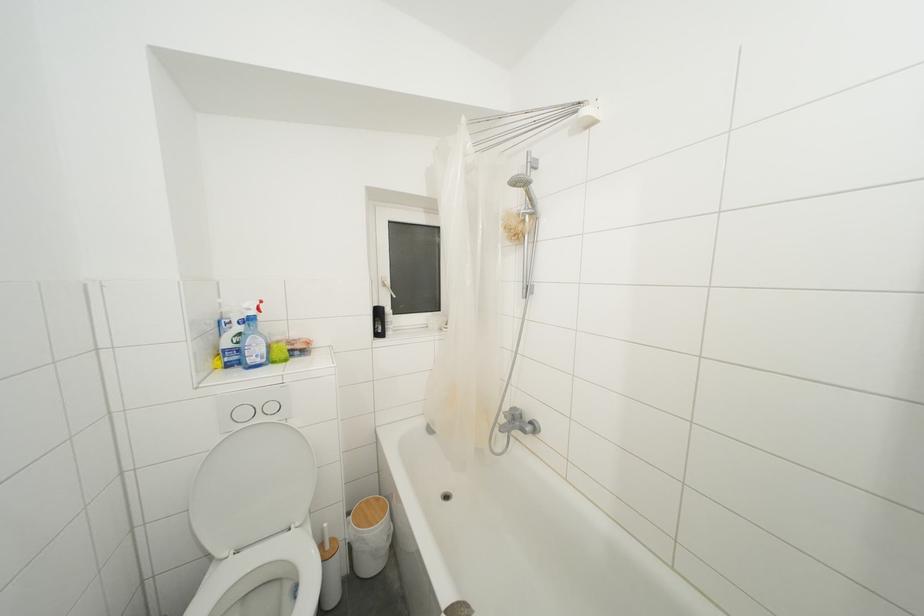
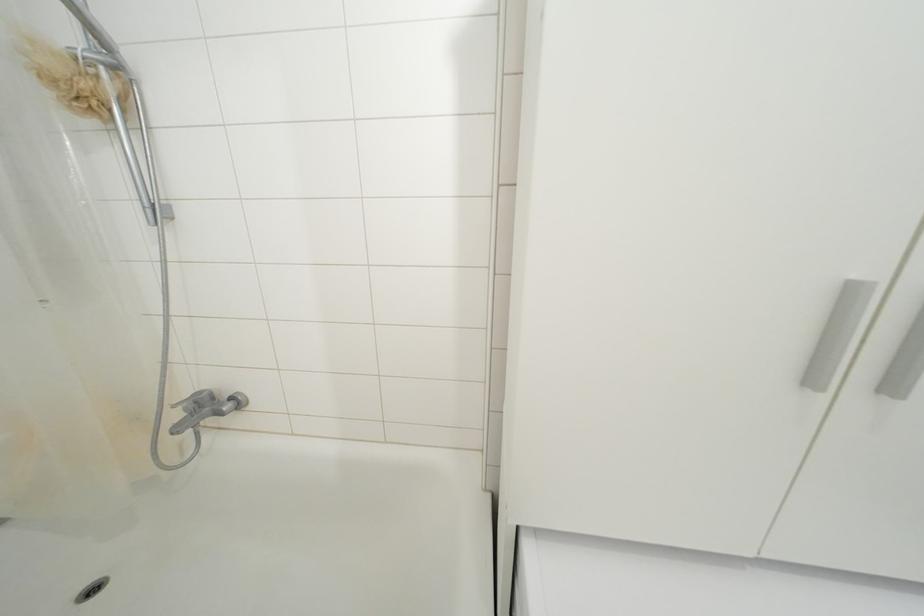
Question: The first image is from the beginning of the video and the second image is from the end. How did the camera likely rotate when shooting the video?

Choices:
 (A) Left
 (B) Right
 (C) Up
 (D) Down

Answer: (B)